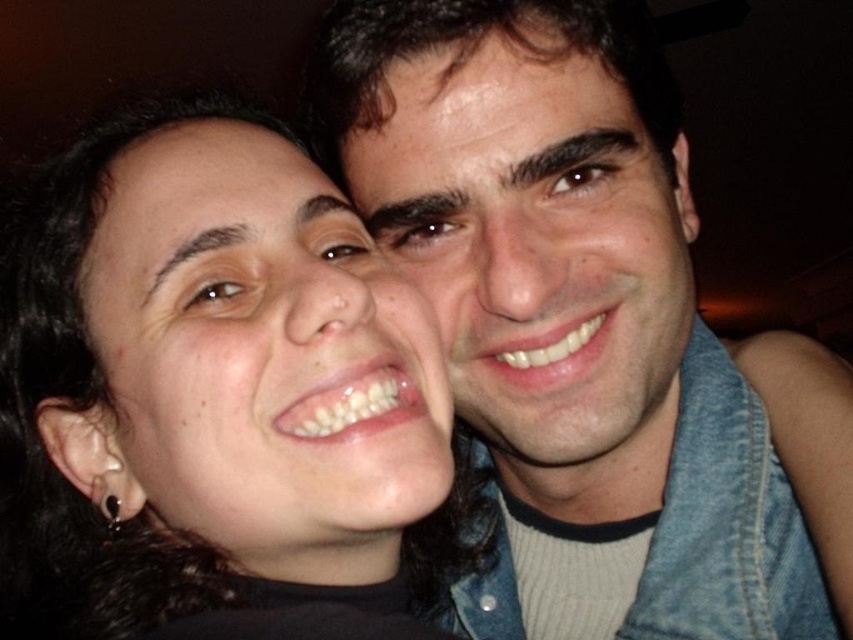
You are a photographer adjusting the lighting for a portrait. You notice the matte blue shirt at upper right and the smooth skin face at center in the frame. Which object should you focus on to ensure proper exposure, considering their size differences?

The matte blue shirt at upper right is larger in size than the smooth skin face at center, so focusing on the matte blue shirt at upper right would ensure proper exposure due to its larger size dominating the frame.

You are a photographer trying to adjust the lighting for a photo shoot. You notice the matte blue shirt at upper right and the smooth skin face at center in the frame. Which object is positioned to the left of the other?

The matte blue shirt at upper right is to the left of the smooth skin face at center according to the description.